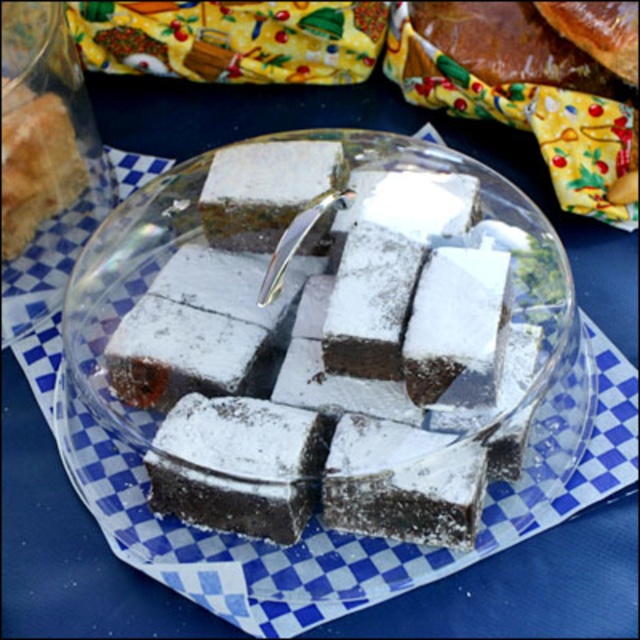
You are a photographer trying to capture the powdered chocolate cake at center. Your camera is set to focus on the point at coordinates point [330,406]. Will this point be the center of the cake?

The powdered chocolate cake at center is represented by point [330,406], so yes, focusing on that point will center the cake in the photo.

You are setting up a picnic and see the yellow fabric at upper center and the white powdered cake at center. Which object is positioned to the right of the other?

The yellow fabric at upper center is to the right of the white powdered cake at center.